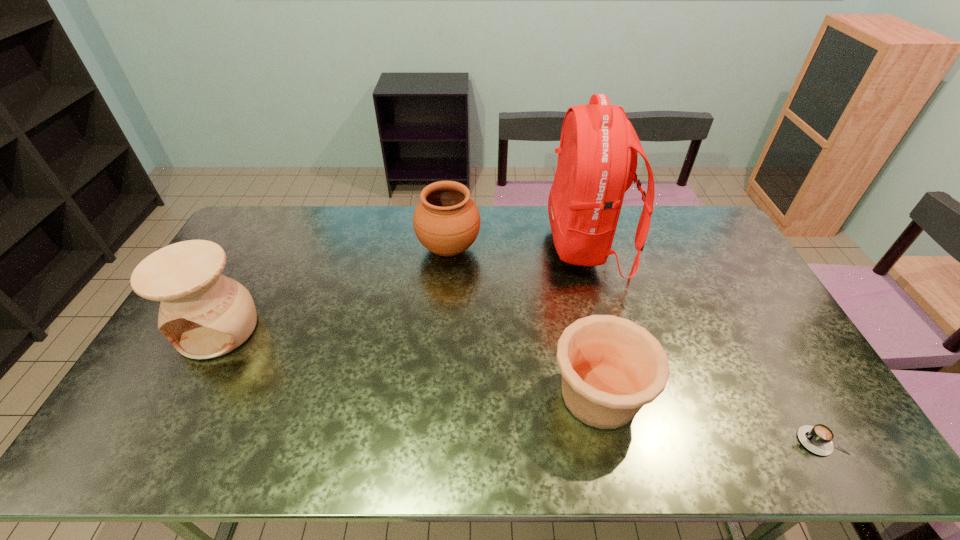
Where is `the closest pottery to the shortest pottery`? The image size is (960, 540). the closest pottery to the shortest pottery is located at coordinates (446, 221).